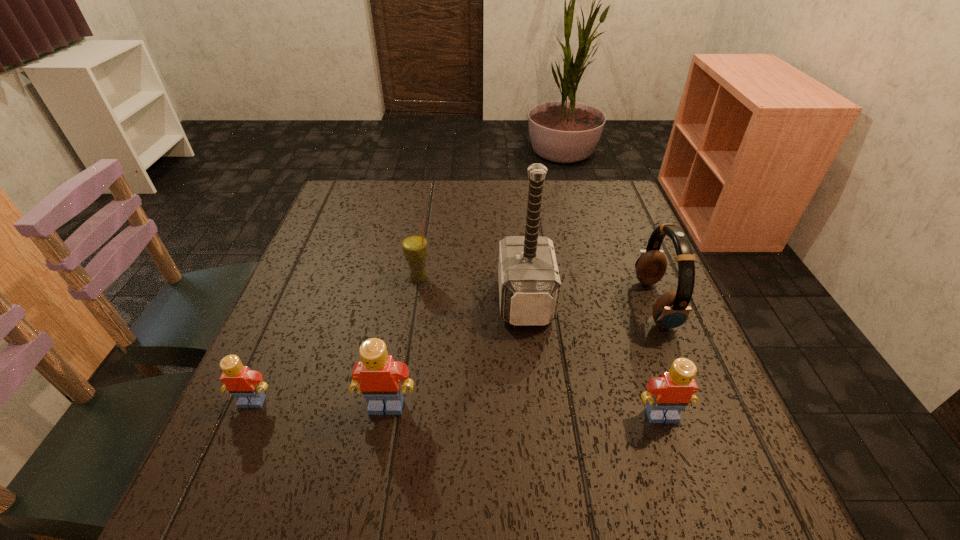
Locate an element on the screen. object positioned at the near left corner is located at coordinates (246, 385).

You are a GUI agent. You are given a task and a screenshot of the screen. Output one action in this format:
    pyautogui.click(x=<x>, y=<y>)
    Task: Click on the object that is at the near right corner
    The height and width of the screenshot is (540, 960).
    Given the screenshot: What is the action you would take?
    pyautogui.click(x=667, y=395)

Image resolution: width=960 pixels, height=540 pixels. In order to click on vacant space at the far edge of the desktop in this screenshot , I will do `click(544, 186)`.

Locate an element on the screen. vacant space at the near edge is located at coordinates (397, 438).

In the image, there is a desktop. Identify the location of vacant space at the left edge. (310, 268).

The width and height of the screenshot is (960, 540). Find the location of `vacant space at the right edge of the desktop`. vacant space at the right edge of the desktop is located at coordinates (619, 226).

Locate an element on the screen. The height and width of the screenshot is (540, 960). vacant space at the far left corner of the desktop is located at coordinates (351, 199).

The image size is (960, 540). In the image, there is a desktop. What are the coordinates of `blank space at the near left corner` in the screenshot? It's located at (230, 429).

At what (x,y) coordinates should I click in order to perform the action: click on free space at the far right corner of the desktop. Please return your answer as a coordinate pair (x, y). Looking at the image, I should click on (590, 205).

Image resolution: width=960 pixels, height=540 pixels. I want to click on empty location between the rightmost Lego and the shortest Lego, so click(457, 408).